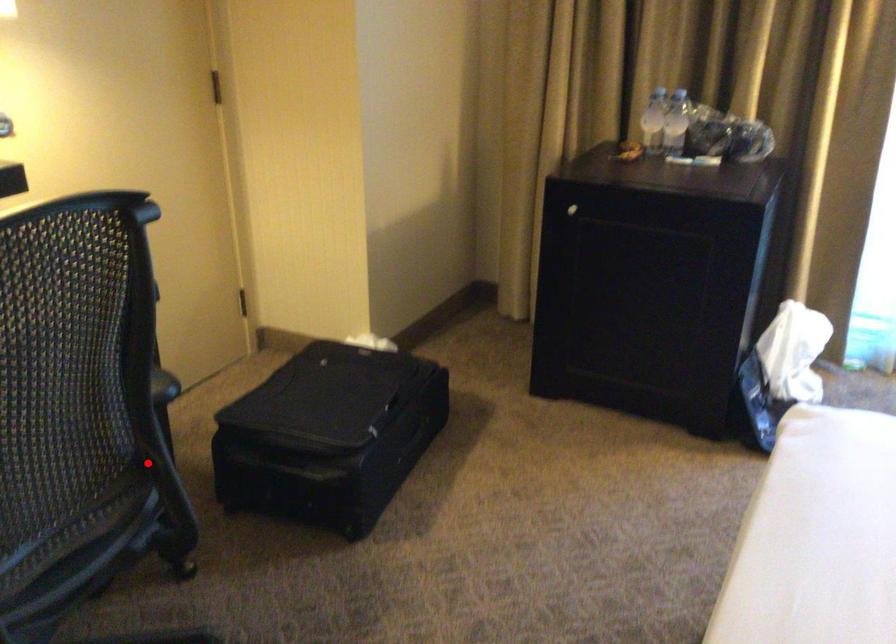
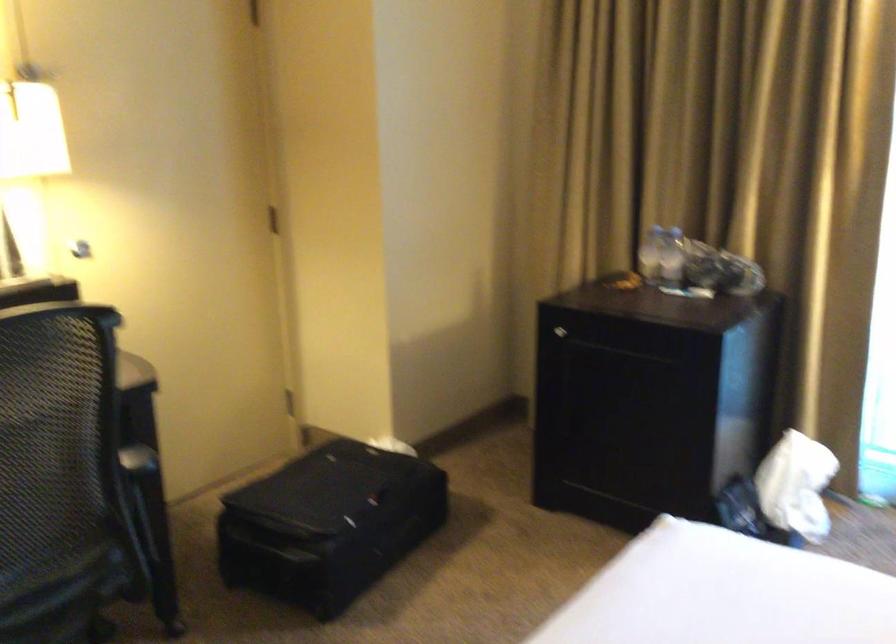
In the second image, find the point that corresponds to the highlighted location in the first image.

(136, 527)